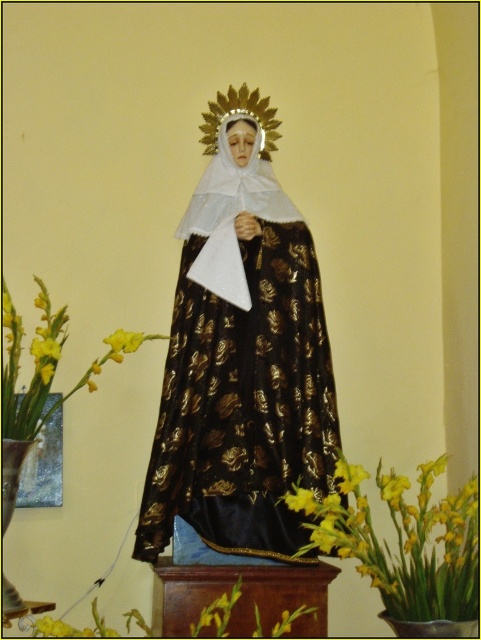
Question: Which object appears closest to the camera in this image?

Choices:
 (A) yellow matte flower at center
 (B) yellow glossy flowers at lower right
 (C) yellow matte flower at lower center
 (D) shiny gold fabric statue at center

Answer: (B)

Question: Estimate the real-world distances between objects in this image. Which object is farther from the yellow glossy flowers at lower right?

Choices:
 (A) shiny gold fabric statue at center
 (B) yellow matte flower at lower center
 (C) yellow matte flower at center

Answer: (A)

Question: Does shiny gold fabric statue at center have a lesser width compared to yellow glossy flowers at lower right?

Choices:
 (A) no
 (B) yes

Answer: (A)

Question: Does yellow matte flower at center appear on the right side of yellow matte flower at lower center?

Choices:
 (A) no
 (B) yes

Answer: (B)

Question: Can you confirm if yellow matte flower at center is positioned above yellow matte flower at lower center?

Choices:
 (A) no
 (B) yes

Answer: (B)

Question: Which is nearer to the yellow matte flower at center?

Choices:
 (A) shiny gold fabric statue at center
 (B) yellow matte flower at lower center
 (C) yellow glossy flowers at lower right

Answer: (B)